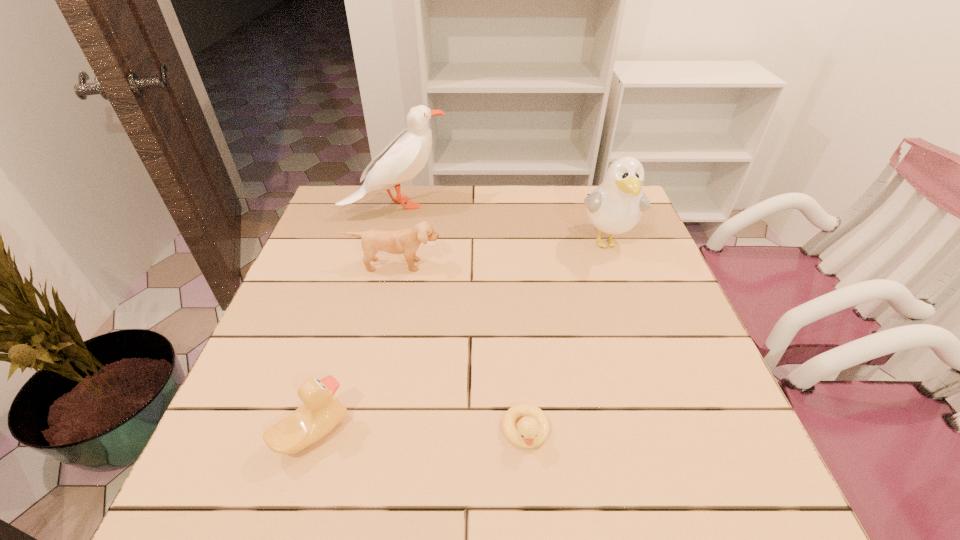
What are the coordinates of `object positioned at the far right corner` in the screenshot? It's located at (616, 205).

In the image, there is a desktop. Identify the location of vacant space at the far edge. This screenshot has width=960, height=540. (461, 201).

Identify the location of vacant space at the left edge of the desktop. (278, 384).

I want to click on vacant space at the right edge, so click(x=644, y=348).

You are a GUI agent. You are given a task and a screenshot of the screen. Output one action in this format:
    pyautogui.click(x=<x>, y=<y>)
    Task: Click on the vacant region at the far left corner
    This screenshot has width=960, height=540.
    Given the screenshot: What is the action you would take?
    pyautogui.click(x=351, y=211)

The image size is (960, 540). In order to click on blank region between the rightmost object and the shortest object in this screenshot , I will do `click(566, 336)`.

The height and width of the screenshot is (540, 960). What are the coordinates of `unoccupied position between the fourth object from left to right and the farthest object` in the screenshot? It's located at (461, 318).

In order to click on vacant space in between the duck and the nearer gull in this screenshot , I will do `click(460, 337)`.

At what (x,y) coordinates should I click in order to perform the action: click on vacant area that lies between the nearer gull and the fourth object from left to right. Please return your answer as a coordinate pair (x, y). Looking at the image, I should click on (566, 336).

Find the location of a particular element. The image size is (960, 540). vacant area that lies between the shortest object and the puppy is located at coordinates (460, 348).